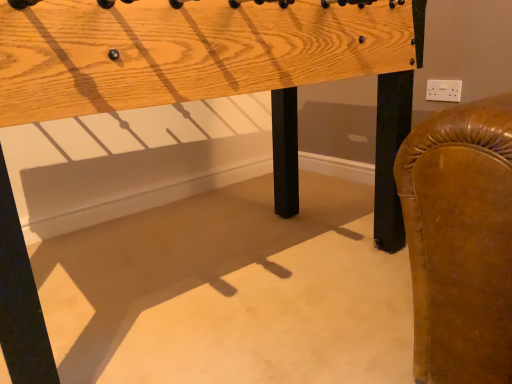
Where is `white plastic electric outlet at upper right`? Image resolution: width=512 pixels, height=384 pixels. white plastic electric outlet at upper right is located at coordinates (444, 90).

Describe the element at coordinates (444, 90) in the screenshot. I see `white plastic electric outlet at upper right` at that location.

In order to click on white plastic electric outlet at upper right in this screenshot , I will do `click(444, 90)`.